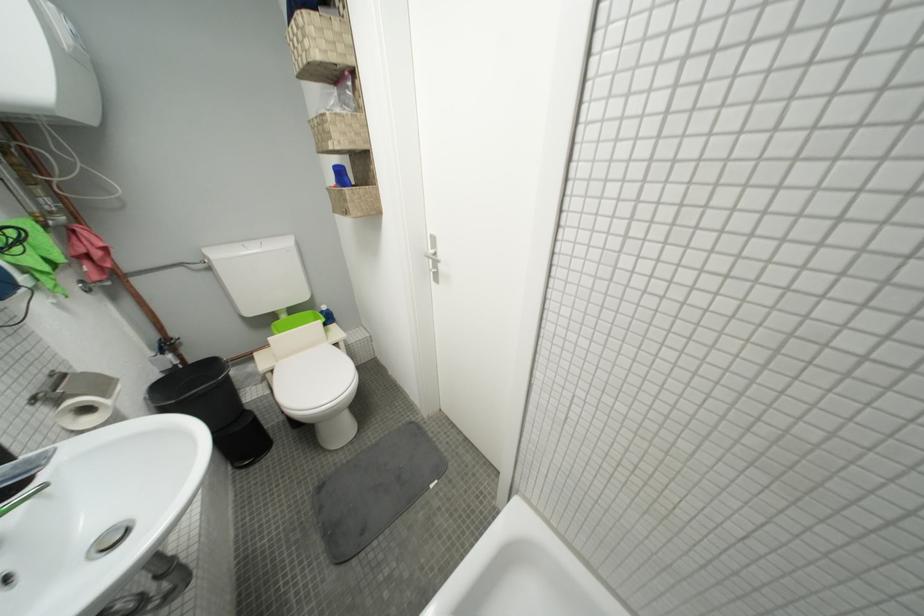
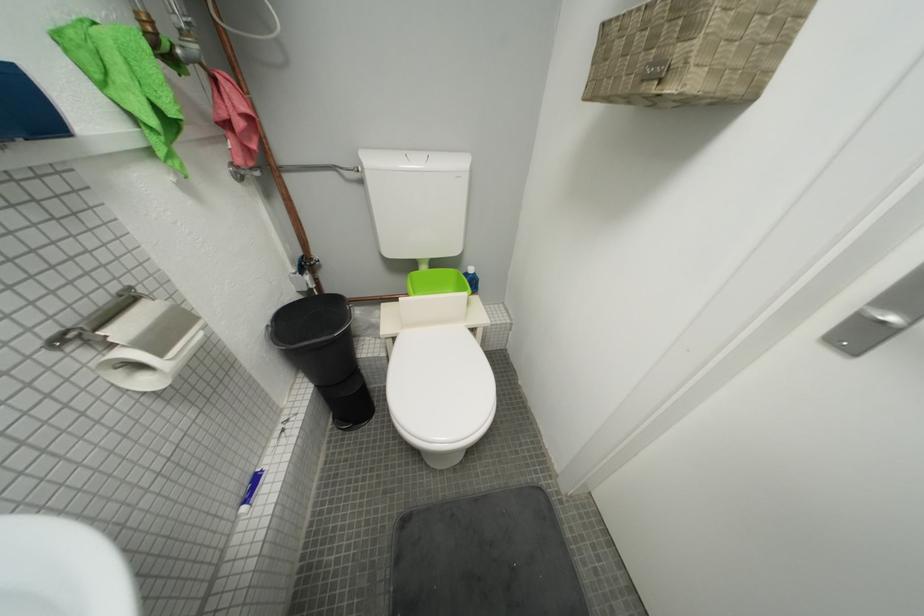
Question: Based on the continuous images, in which direction is the camera rotating? Reply with the corresponding letter.

Choices:
 (A) Left
 (B) Right
 (C) Up
 (D) Down

Answer: (A)